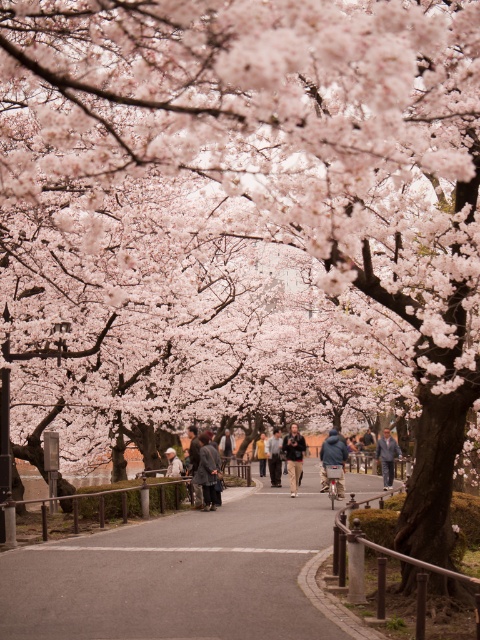
You are a photographer standing on the asphalt road at center. You want to take a photo of the dark gray coat at center. Is the distance between them sufficient for a clear, detailed photo without needing to zoom in excessively?

The asphalt road at center and dark gray coat at center are 3.06 meters apart from each other. At this distance, a photographer can capture a clear, detailed photo of the dark gray coat at center without excessive zooming.

You are a photographer standing on the pathway lined with cherry blossom trees. You want to take a photo that includes both the dark blue jacket at center and the light beige fabric jacket at center. Which jacket will appear larger in the photo?

The dark blue jacket at center will appear larger in the photo because it is much taller than the light beige fabric jacket at center.

You are a photographer standing on the pathway lined with cherry blossom trees. You see two people wearing a dark gray coat at center and a light beige fabric jacket at center. Which one is on the right side when facing the jackets?

The dark gray coat at center is positioned on the right side of light beige fabric jacket at center, so the dark gray coat at center is on the right side when facing the jackets.